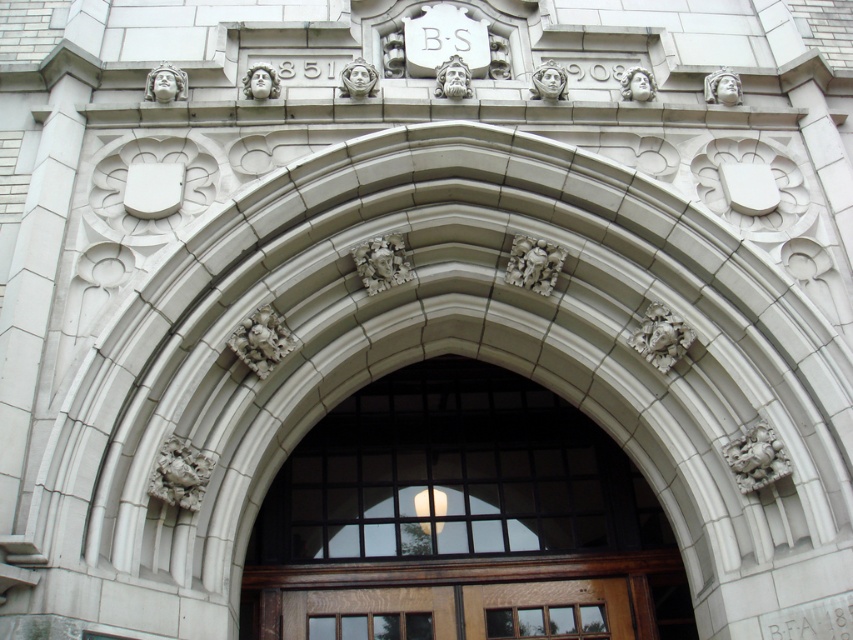
Does wooden door at center have a lesser height compared to mahogany wood door at center?

No.

In the scene shown: Is wooden door at center to the right of mahogany wood door at center from the viewer's perspective?

Correct, you'll find wooden door at center to the right of mahogany wood door at center.

Is point (421, 573) farther from viewer compared to point (282, 618)?

Yes, it is behind point (282, 618).

In order to click on wooden door at center in this screenshot , I will do `click(457, 515)`.